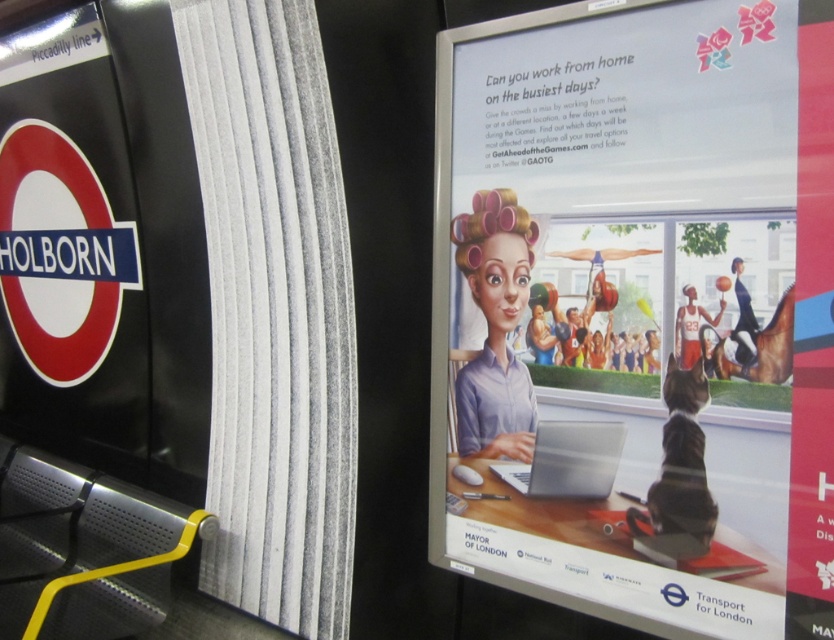
Does matte white laptop at center appear on the left side of metallic silver signboard at left?

In fact, matte white laptop at center is to the right of metallic silver signboard at left.

Who is more distant from viewer, (819, 332) or (18, 376)?

Positioned behind is point (18, 376).

Does point (649, 349) come in front of point (330, 243)?

That is True.

Where is `matte white laptop at center`? The image size is (834, 640). matte white laptop at center is located at coordinates (641, 307).

From the picture: Who is positioned more to the left, matte white laptop at center or silver metallic laptop at center?

Positioned to the left is silver metallic laptop at center.

From the picture: Can you confirm if matte white laptop at center is positioned below silver metallic laptop at center?

No.

This screenshot has height=640, width=834. What do you see at coordinates (641, 307) in the screenshot? I see `matte white laptop at center` at bounding box center [641, 307].

Find the location of a particular element. The height and width of the screenshot is (640, 834). matte white laptop at center is located at coordinates (641, 307).

Which is behind, point (94, 230) or point (564, 456)?

Positioned behind is point (94, 230).

Who is positioned more to the right, metallic silver signboard at left or silver metallic laptop at center?

silver metallic laptop at center is more to the right.

Describe the element at coordinates (176, 310) in the screenshot. I see `metallic silver signboard at left` at that location.

At what (x,y) coordinates should I click in order to perform the action: click on metallic silver signboard at left. Please return your answer as a coordinate pair (x, y). Looking at the image, I should click on (176, 310).